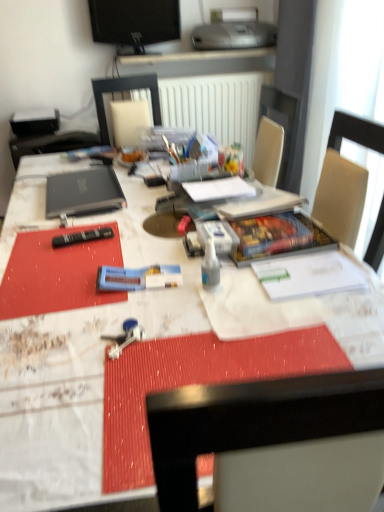
You are a GUI agent. You are given a task and a screenshot of the screen. Output one action in this format:
    pyautogui.click(x=<x>, y=<y>)
    Task: Click on the free space to the right of transparent plastic bottle at center
    
    Given the screenshot: What is the action you would take?
    pyautogui.click(x=276, y=286)